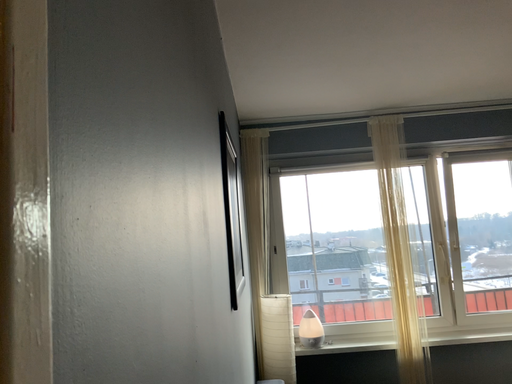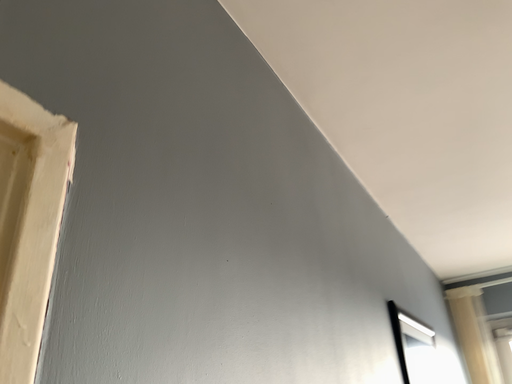
Question: How did the camera likely rotate when shooting the video?

Choices:
 (A) rotated downward
 (B) rotated upward

Answer: (B)